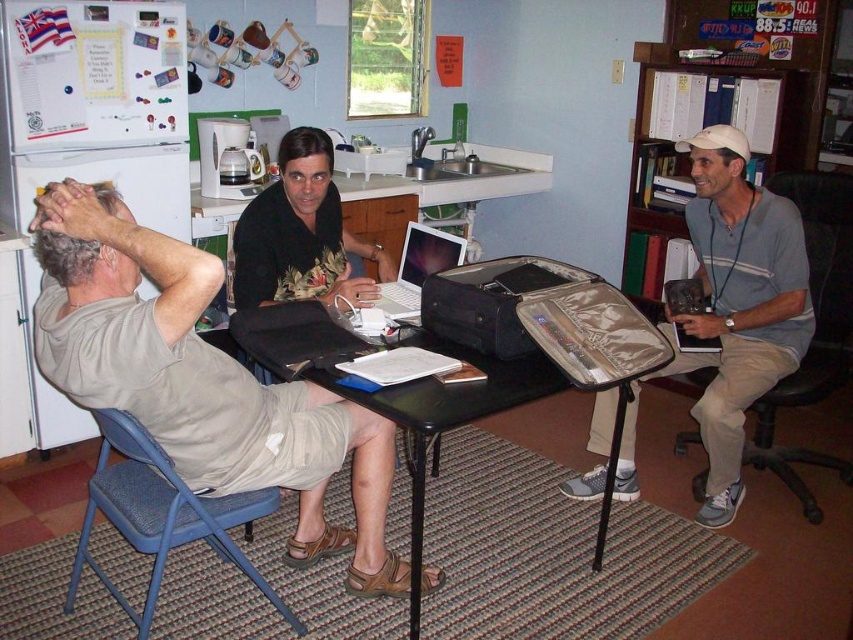
Question: Is black floral shirt at center above matte black shirt at center?

Choices:
 (A) no
 (B) yes

Answer: (A)

Question: Which point appears farthest from the camera in this image?

Choices:
 (A) (102, 186)
 (B) (786, 344)

Answer: (B)

Question: Which is farther from the black floral shirt at center?

Choices:
 (A) gray fabric bag at right
 (B) light brown leather sandal at lower center

Answer: (A)

Question: Which point appears farthest from the camera in this image?

Choices:
 (A) (306, 147)
 (B) (180, 531)
 (C) (706, 177)
 (D) (838, 346)

Answer: (D)

Question: Can you confirm if light brown leather sandal at lower center is positioned to the left of matte black shirt at center?

Choices:
 (A) yes
 (B) no

Answer: (A)

Question: From the image, what is the correct spatial relationship of black floral shirt at center in relation to black leather chair at right?

Choices:
 (A) right
 (B) left

Answer: (B)